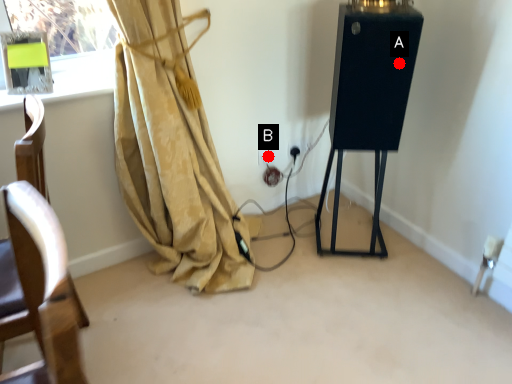
Question: Two points are circled on the image, labeled by A and B beside each circle. Which of the following is the farthest from the observer?

Choices:
 (A) A is further
 (B) B is further

Answer: (B)